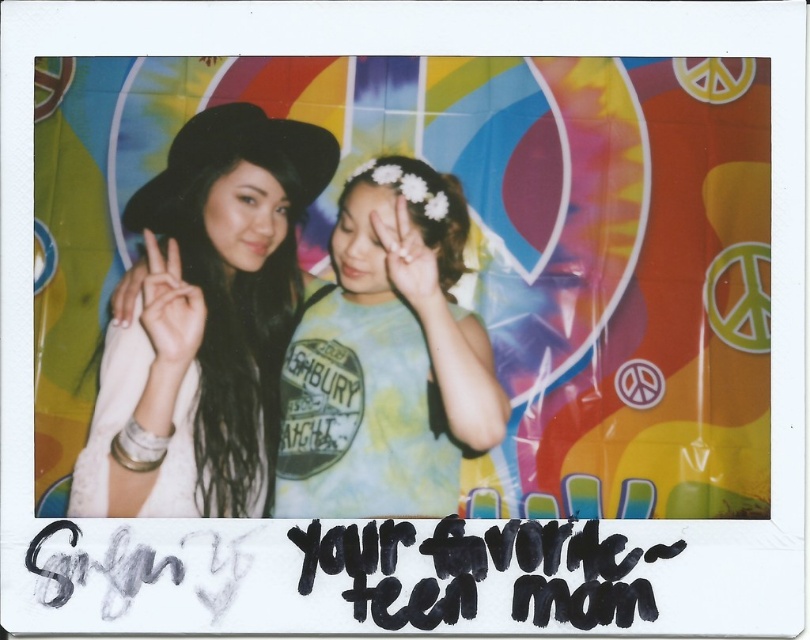
In the scene shown: You are trying to determine which hand is closer to the camera in the photo. Looking at the matte black hand at center and the white matte hand at center, which one appears to be in front?

The matte black hand at center is in front of the white matte hand at center, so the matte black hand at center is closer to the camera.

Based on the photo, you are holding a 28 inch wide poster and want to hang it on the wall at point (472, 422). Considering the distance from you to that point is 31.28 inches, will the poster fit without overlapping the edges?

The distance between you and the point is 31.28 inches, which is greater than the poster width of 28 inches. Therefore, the poster will fit without overlapping the edges.